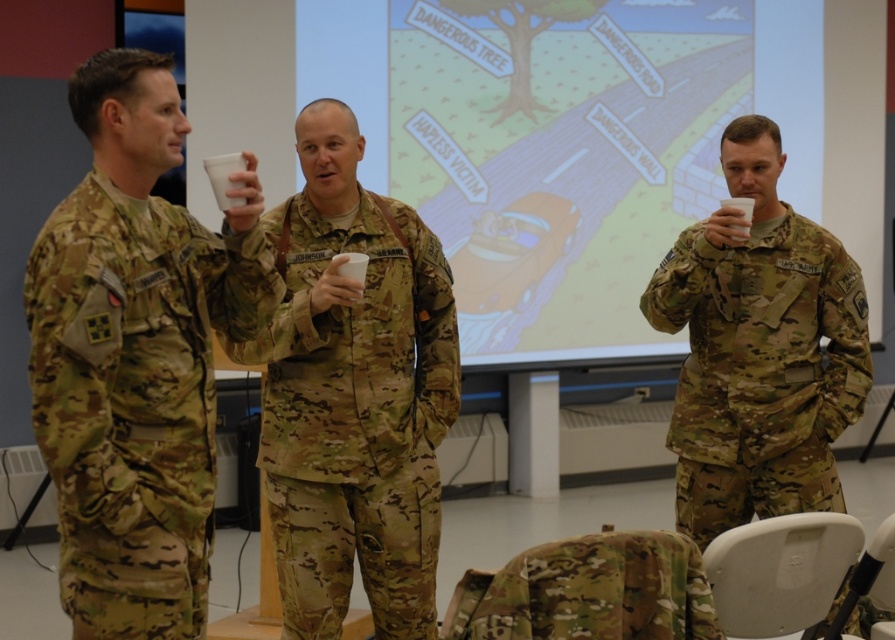
Is camouflage fabric uniform at left closer to camera compared to camouflage uniform at center?

Yes.

Can you confirm if camouflage fabric uniform at left is taller than camouflage uniform at center?

No, camouflage fabric uniform at left is not taller than camouflage uniform at center.

The image size is (895, 640). I want to click on camouflage fabric uniform at left, so click(135, 397).

Is camouflage fabric uniform at left shorter than camo fabric uniform at center?

Correct, camouflage fabric uniform at left is not as tall as camo fabric uniform at center.

This screenshot has height=640, width=895. I want to click on camouflage fabric uniform at left, so click(x=135, y=397).

Does camo fabric uniform at center lie in front of camouflage uniform at center?

That is True.

Which is below, camo fabric uniform at center or camouflage uniform at center?

Positioned lower is camo fabric uniform at center.

Is point (299, 561) closer to camera compared to point (811, 493)?

Yes.

You are a GUI agent. You are given a task and a screenshot of the screen. Output one action in this format:
    pyautogui.click(x=<x>, y=<y>)
    Task: Click on the camo fabric uniform at center
    Image resolution: width=895 pixels, height=640 pixels.
    Given the screenshot: What is the action you would take?
    click(356, 417)